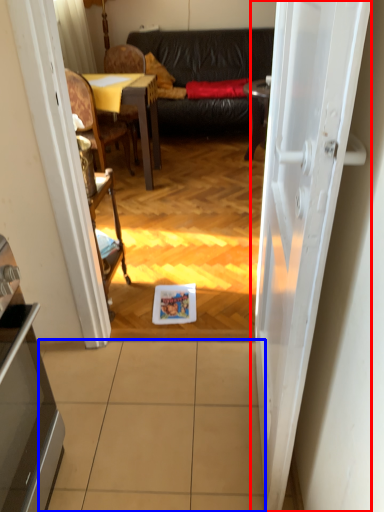
Question: Which object appears farthest to the camera in this image, door (highlighted by a red box) or tile (highlighted by a blue box)?

Choices:
 (A) door
 (B) tile

Answer: (B)